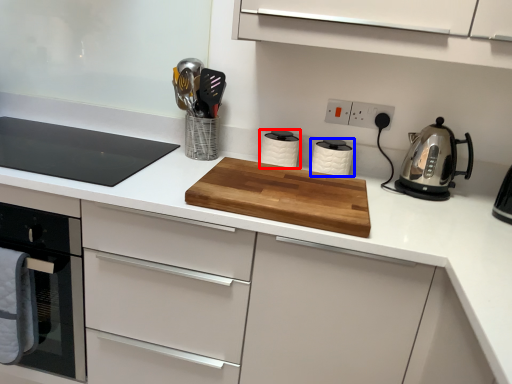
Question: Which object is further to the camera taking this photo, kitchen appliance (highlighted by a red box) or kitchen appliance (highlighted by a blue box)?

Choices:
 (A) kitchen appliance
 (B) kitchen appliance

Answer: (A)